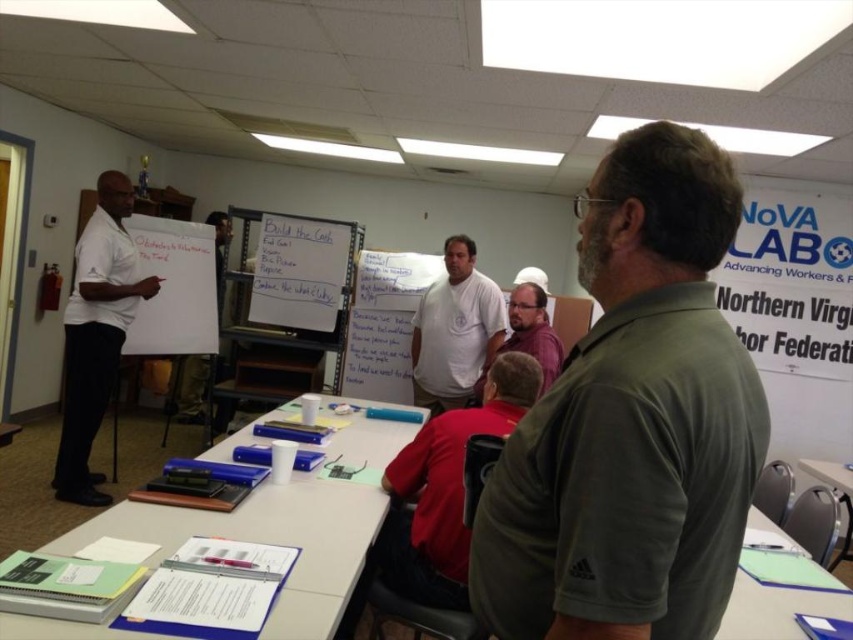
Question: Which point appears closest to the camera in this image?

Choices:
 (A) (76, 368)
 (B) (483, 332)

Answer: (A)

Question: Which object is the closest to the green matte shirt at center?

Choices:
 (A) white paper at center
 (B) white matte shirt at left
 (C) matte purple shirt at center
 (D) red matte shirt at center

Answer: (A)

Question: In this image, where is white matte shirt at left located relative to whiteboard at center?

Choices:
 (A) below
 (B) above

Answer: (B)

Question: Is white cotton shirt at center below matte purple shirt at center?

Choices:
 (A) yes
 (B) no

Answer: (B)

Question: Is matte purple shirt at center bigger than whiteboard at center?

Choices:
 (A) no
 (B) yes

Answer: (B)

Question: Estimate the real-world distances between objects in this image. Which object is closer to the white cotton shirt at center?

Choices:
 (A) whiteboard at center
 (B) matte purple shirt at center

Answer: (B)